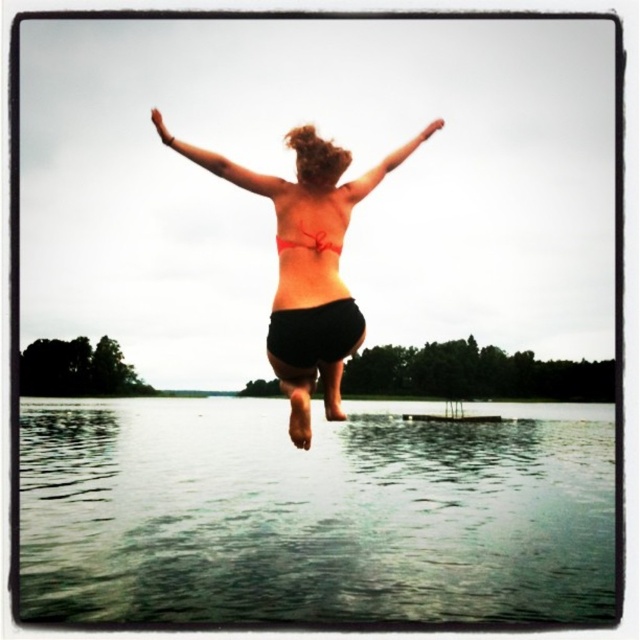
Which is in front, point (509, 618) or point (301, 243)?

Point (301, 243)

Between point (172, 412) and point (301, 228), which one is positioned behind?

The point (172, 412) is more distant.

Identify the location of clear water at lower center. (314, 513).

In order to click on clear water at lower center in this screenshot , I will do `click(314, 513)`.

Which is in front, point (266, 541) or point (221, 156)?

Point (221, 156)

Is clear water at lower center wider than matte black bikini at center?

Correct, the width of clear water at lower center exceeds that of matte black bikini at center.

Which is in front, point (145, 529) or point (304, 438)?

Point (304, 438)

Locate an element on the screen. The width and height of the screenshot is (640, 640). clear water at lower center is located at coordinates (314, 513).

Where is `matte skin arm at upper center`? matte skin arm at upper center is located at coordinates (220, 163).